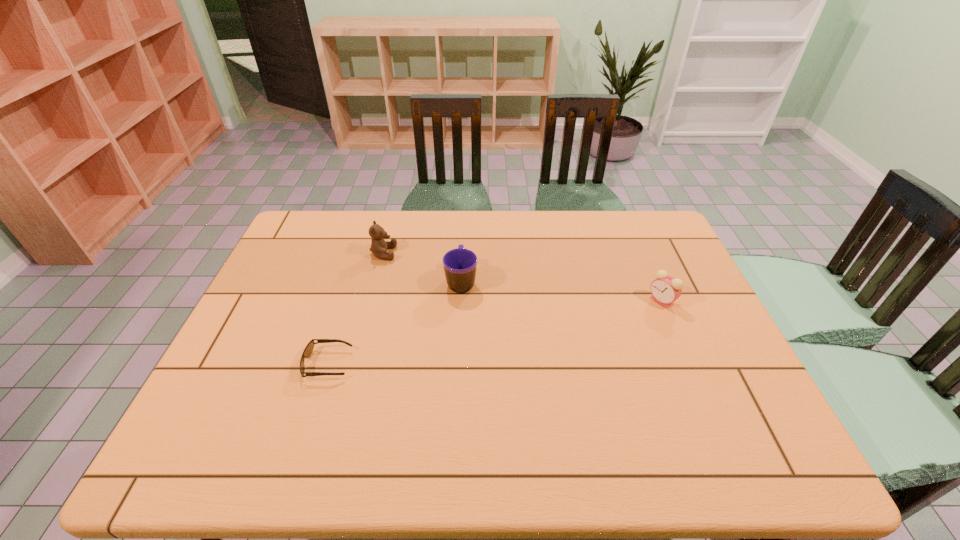
Locate an element on the screen. The image size is (960, 540). the closest object relative to the third object from left to right is located at coordinates (379, 246).

Locate an element on the screen. This screenshot has height=540, width=960. free space that satisfies the following two spatial constraints: 1. with the handle on the side of the mug; 2. on the front-facing side of the teddy bear is located at coordinates (463, 253).

The width and height of the screenshot is (960, 540). I want to click on vacant region that satisfies the following two spatial constraints: 1. on the front-facing side of the teddy bear; 2. with the handle on the side of the mug, so click(x=376, y=281).

Where is `free space that satisfies the following two spatial constraints: 1. on the front-facing side of the farthest object; 2. with the handle on the side of the third object from left to right`? The width and height of the screenshot is (960, 540). free space that satisfies the following two spatial constraints: 1. on the front-facing side of the farthest object; 2. with the handle on the side of the third object from left to right is located at coordinates (376, 281).

Identify the location of vacant space that satisfies the following two spatial constraints: 1. on the front-facing side of the farthest object; 2. with the handle on the side of the mug. This screenshot has width=960, height=540. (376, 281).

Locate an element on the screen. vacant space that satisfies the following two spatial constraints: 1. on the front-facing side of the farthest object; 2. with the handle on the side of the mug is located at coordinates (376, 281).